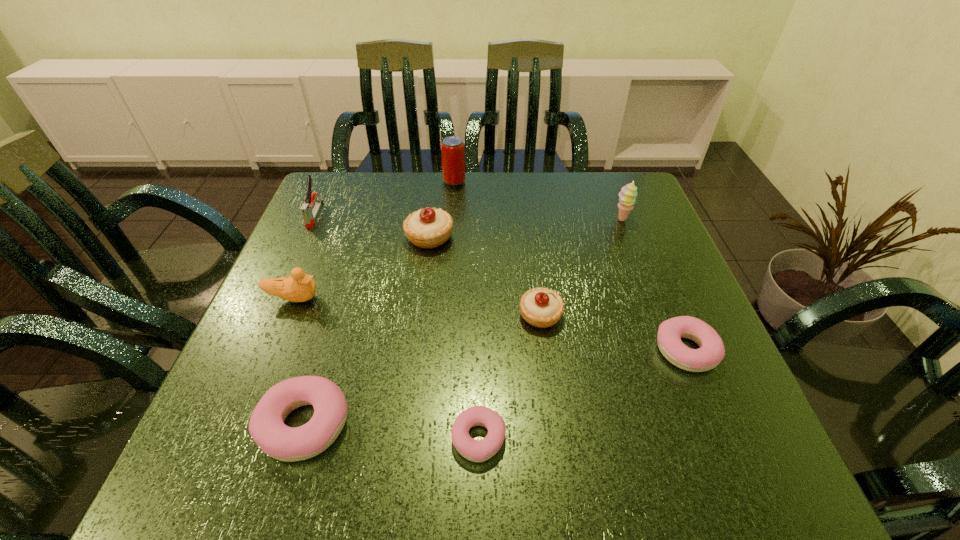
Image resolution: width=960 pixels, height=540 pixels. I want to click on sherbert that is positioned at the right edge, so click(627, 196).

The image size is (960, 540). Identify the location of pastry present at the right edge. (711, 352).

This screenshot has width=960, height=540. Identify the location of object located at the far left corner. (309, 216).

Identify the location of object that is at the near left corner. The height and width of the screenshot is (540, 960). [x=266, y=426].

Identify the location of object positioned at the far right corner. (627, 196).

At what (x,y) coordinates should I click in order to perform the action: click on free space at the far edge of the desktop. Please return your answer as a coordinate pair (x, y). The width and height of the screenshot is (960, 540). Looking at the image, I should click on (536, 191).

In the image, there is a desktop. At what (x,y) coordinates should I click in order to perform the action: click on vacant space at the near edge. Please return your answer as a coordinate pair (x, y). This screenshot has width=960, height=540. Looking at the image, I should click on (394, 443).

This screenshot has height=540, width=960. In the image, there is a desktop. What are the coordinates of `free space at the left edge` in the screenshot? It's located at (338, 232).

Find the location of `free region at the right edge of the desktop`. free region at the right edge of the desktop is located at coordinates (601, 230).

At what (x,y) coordinates should I click in order to perform the action: click on vacant space at the far left corner of the desktop. Please return your answer as a coordinate pair (x, y). This screenshot has width=960, height=540. Looking at the image, I should click on (325, 204).